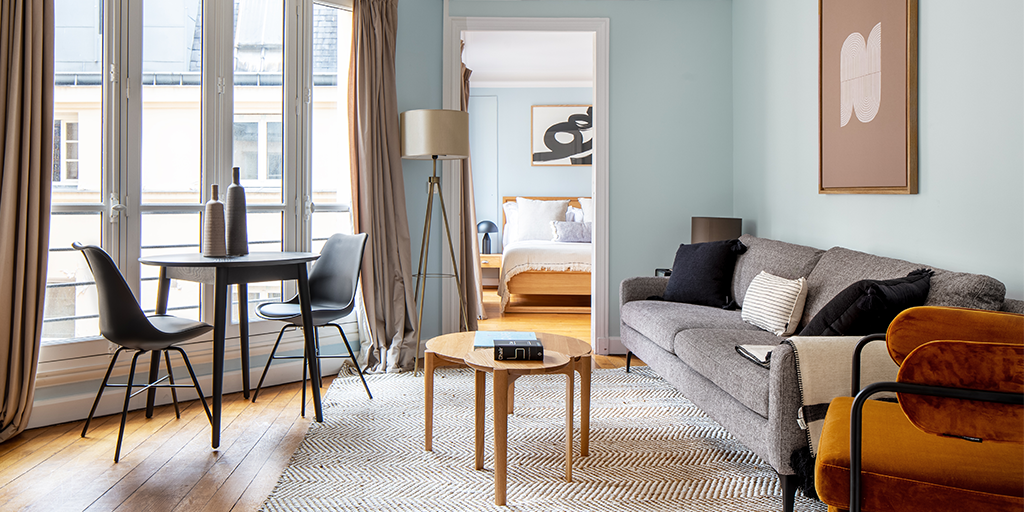
You are a GUI agent. You are given a task and a screenshot of the screen. Output one action in this format:
    pyautogui.click(x=<x>, y=<y>)
    Task: Click on the paintings
    
    Given the screenshot: What is the action you would take?
    pyautogui.click(x=901, y=110), pyautogui.click(x=543, y=129)